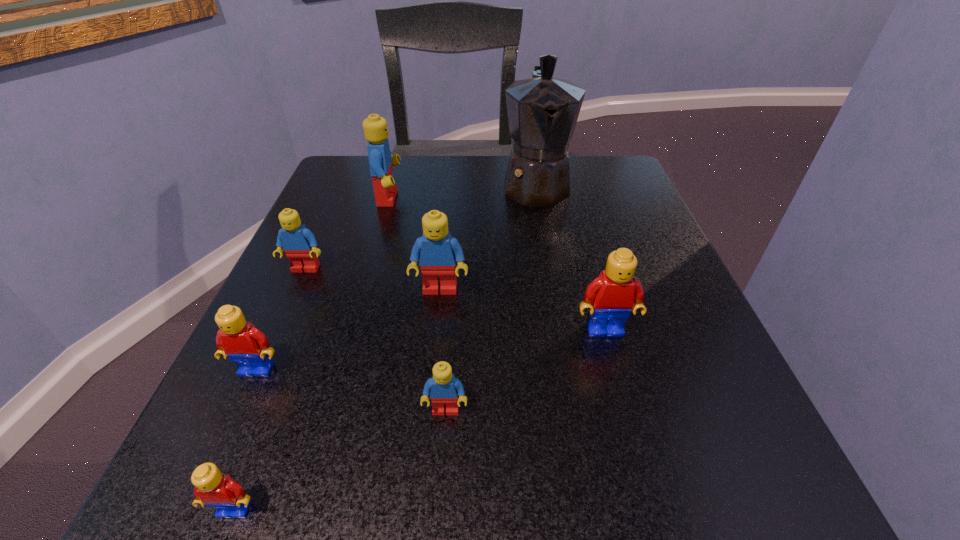
This screenshot has width=960, height=540. Identify the location of the fifth farthest Lego. (247, 346).

Locate an element on the screen. the sixth farthest Lego is located at coordinates (443, 388).

This screenshot has width=960, height=540. I want to click on the smallest blue Lego, so click(x=443, y=388).

This screenshot has width=960, height=540. Identify the location of the smallest yellow Lego. (212, 488).

The image size is (960, 540). I want to click on the nearest yellow Lego, so click(212, 488).

Locate an element on the screen. The height and width of the screenshot is (540, 960). blank space located 0.060m on the pouring side of the tallest object is located at coordinates (544, 234).

Find the location of a particular element. The image size is (960, 540). free spot located on the face of the second tallest object is located at coordinates (429, 198).

Where is `free space located on the face of the third farthest blue Lego`? free space located on the face of the third farthest blue Lego is located at coordinates (434, 347).

Locate an element on the screen. This screenshot has width=960, height=540. free space located on the front-facing side of the farthest yellow Lego is located at coordinates (654, 510).

Locate an element on the screen. vacant space positioned on the face of the leftmost blue Lego is located at coordinates (214, 472).